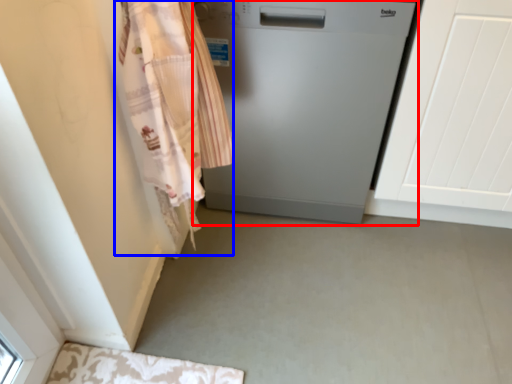
Question: Which point is further to the camera, home appliance (highlighted by a red box) or clothing (highlighted by a blue box)?

Choices:
 (A) home appliance
 (B) clothing

Answer: (A)